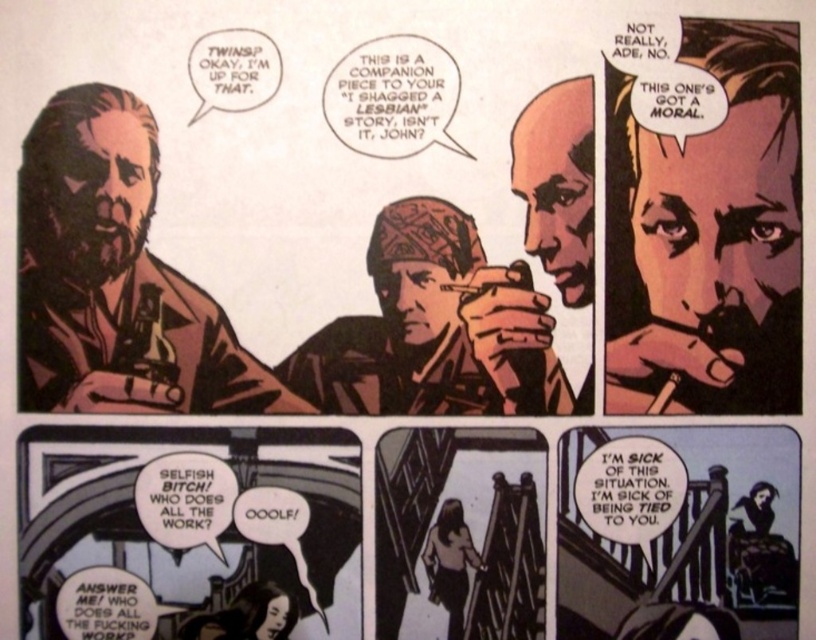
You are a comic book artist analyzing the top left panel. You notice the smooth wooden pipe at upper right and the matte brown bandana at center. Which object is positioned closer to the viewer in this panel?

The smooth wooden pipe at upper right is closer to the viewer than the matte brown bandana at center.

In the comic strip panel, there is a smooth wooden pipe at upper right and a matte brown leather jacket at left. Which object is bigger in size?

The smooth wooden pipe at upper right is bigger in size compared to the matte brown leather jacket at left.